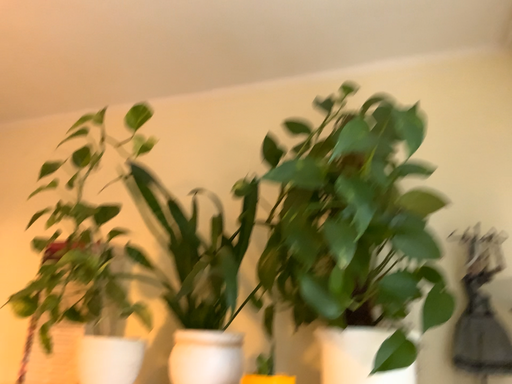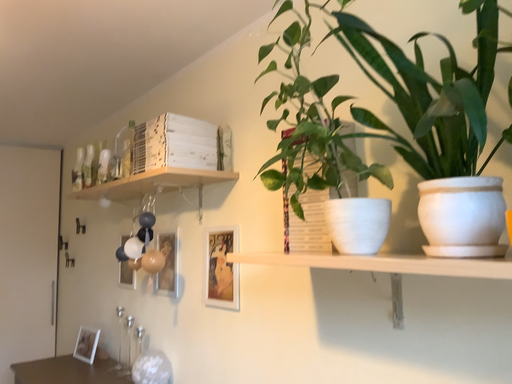
Question: How did the camera likely rotate when shooting the video?

Choices:
 (A) rotated downward
 (B) rotated upward

Answer: (A)